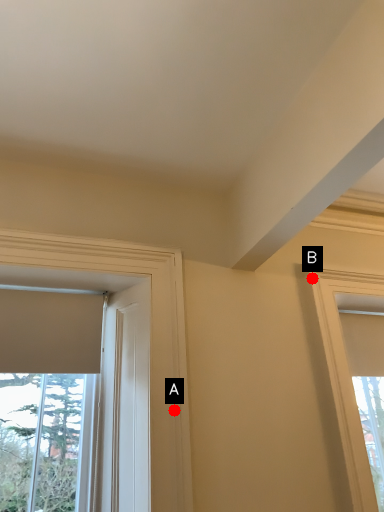
Question: Two points are circled on the image, labeled by A and B beside each circle. Which point appears farthest from the camera in this image?

Choices:
 (A) A is further
 (B) B is further

Answer: (B)